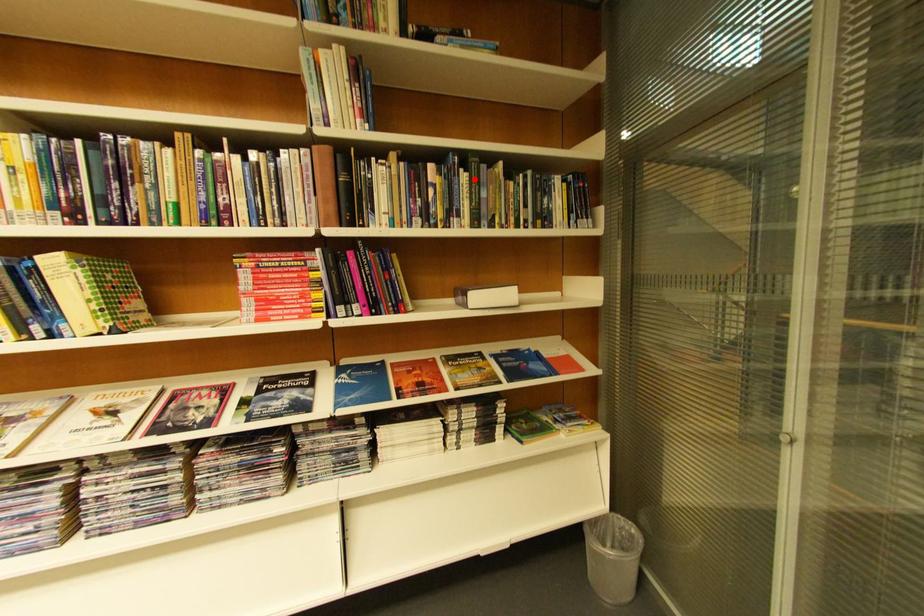
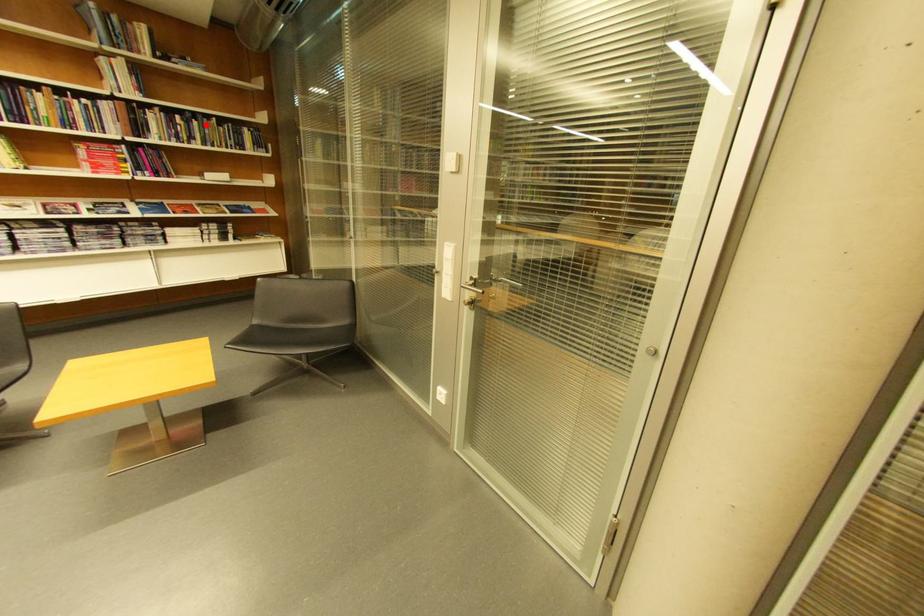
I am providing you with two images of the same scene from different viewpoints. A red point is marked on the first image and another point is marked on the second image. Do the highlighted points in image1 and image2 indicate the same real-world spot?

Yes